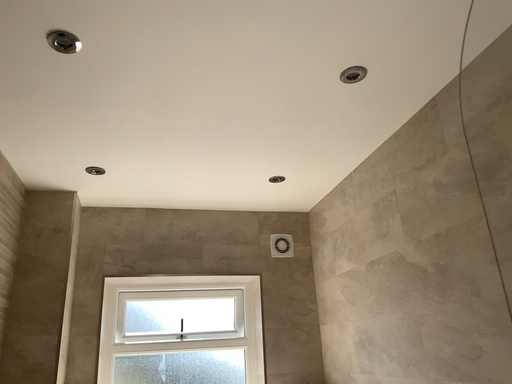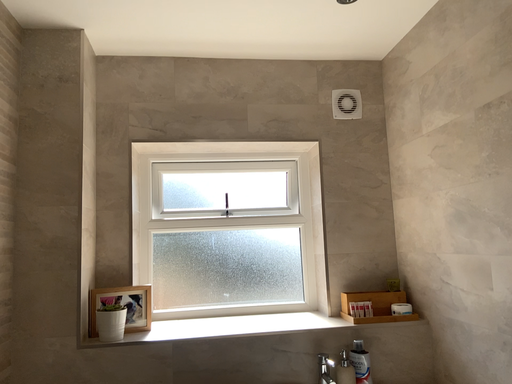
Question: Which way did the camera rotate in the video?

Choices:
 (A) rotated upward
 (B) rotated downward

Answer: (B)